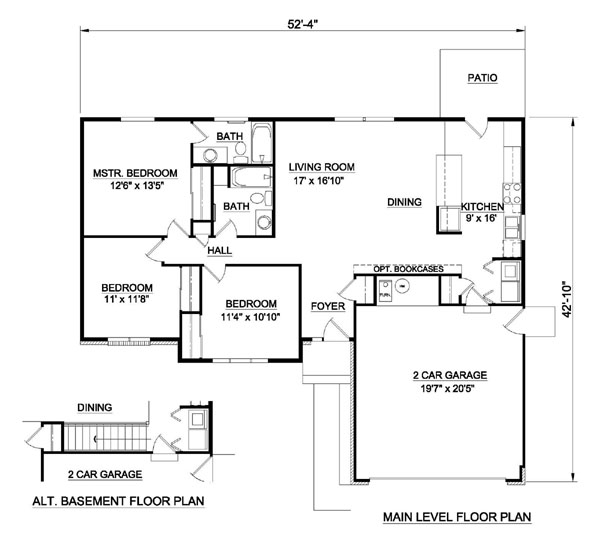
Identify the location of kitchen. pos(476,191).